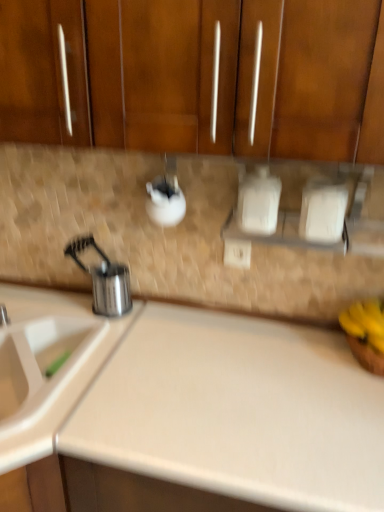
This screenshot has height=512, width=384. Identify the location of free space to the left of stainless steel utensil holder at left. (53, 303).